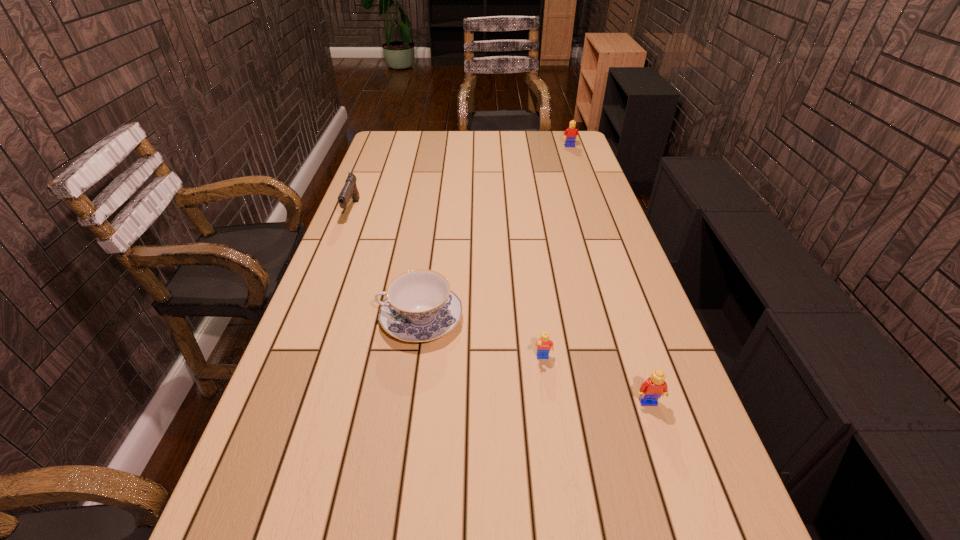
The width and height of the screenshot is (960, 540). I want to click on blank space at the right edge of the desktop, so click(x=605, y=272).

Where is `free spot at the far right corner of the desktop`? This screenshot has width=960, height=540. free spot at the far right corner of the desktop is located at coordinates (554, 134).

The height and width of the screenshot is (540, 960). Find the location of `vacant space that is in between the gun and the second object from left to right`. vacant space that is in between the gun and the second object from left to right is located at coordinates (387, 265).

At what (x,y) coordinates should I click in order to perform the action: click on free area in between the nearest Lego and the gun. Please return your answer as a coordinate pair (x, y). Looking at the image, I should click on (500, 306).

The width and height of the screenshot is (960, 540). What are the coordinates of `free space between the second farthest Lego and the chinaware` in the screenshot? It's located at coord(482,339).

Where is `empty location between the second nearest object and the nearest object`? The width and height of the screenshot is (960, 540). empty location between the second nearest object and the nearest object is located at coordinates (595, 380).

Identify the location of unoccupied area between the farthest object and the gun. (461, 178).

Image resolution: width=960 pixels, height=540 pixels. I want to click on free space between the nearest object and the shortest Lego, so click(x=595, y=380).

Find the location of `vacant area that lies between the second object from left to right and the nearest object`. vacant area that lies between the second object from left to right and the nearest object is located at coordinates (534, 360).

The height and width of the screenshot is (540, 960). I want to click on unoccupied position between the chinaware and the fourth farthest object, so click(482, 339).